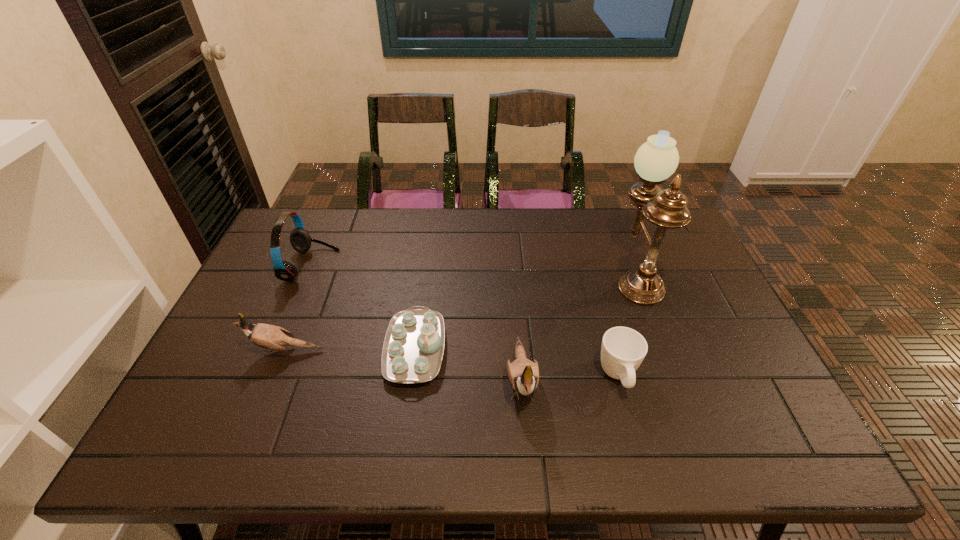
I want to click on vacant area that lies between the headset and the shorter bird, so click(299, 308).

Image resolution: width=960 pixels, height=540 pixels. I want to click on vacant space that's between the tallest object and the left bird, so click(x=461, y=312).

Where is `free spot between the second object from right to left and the left bird`? The width and height of the screenshot is (960, 540). free spot between the second object from right to left and the left bird is located at coordinates (452, 363).

Find the location of a particular element. This screenshot has height=540, width=960. vacant space in between the chinaware and the rightmost object is located at coordinates (525, 311).

Where is `free area in between the cup and the shorter bird`? The width and height of the screenshot is (960, 540). free area in between the cup and the shorter bird is located at coordinates (452, 363).

Find the location of a particular element. This screenshot has width=960, height=540. free space between the second object from right to left and the right bird is located at coordinates (569, 377).

In order to click on the fourth closest object relative to the third object from right to left in this screenshot , I will do `click(266, 336)`.

Locate which object is the third closest to the rightmost object. Please provide its 2D coordinates. Your answer should be formatted as a tuple, i.e. [(x, y)], where the tuple contains the x and y coordinates of a point satisfying the conditions above.

[(413, 348)]

The height and width of the screenshot is (540, 960). I want to click on free space that satisfies the following two spatial constraints: 1. with the microphone attached to the side of the fourth object from right to left; 2. on the left side of the headset, so click(x=276, y=349).

You are a GUI agent. You are given a task and a screenshot of the screen. Output one action in this format:
    pyautogui.click(x=<x>, y=<y>)
    Task: Click on the vacant space that satisfies the following two spatial constraints: 1. with the microphone attached to the side of the headset; 2. on the back side of the tallest object
    
    Given the screenshot: What is the action you would take?
    pyautogui.click(x=308, y=273)